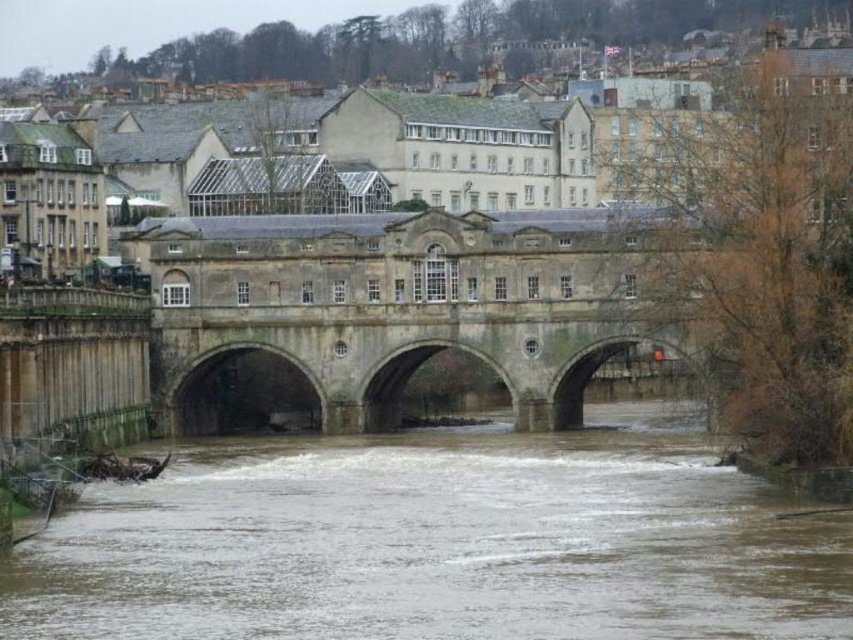
Is point (393, 627) closer to camera compared to point (296, 305)?

Yes, point (393, 627) is closer to viewer.

Is brown muddy water at center shorter than stone bridge at center?

Yes.

Who is more distant from viewer, [564,621] or [265,321]?

Positioned behind is point [265,321].

This screenshot has height=640, width=853. I want to click on brown muddy water at center, so click(438, 544).